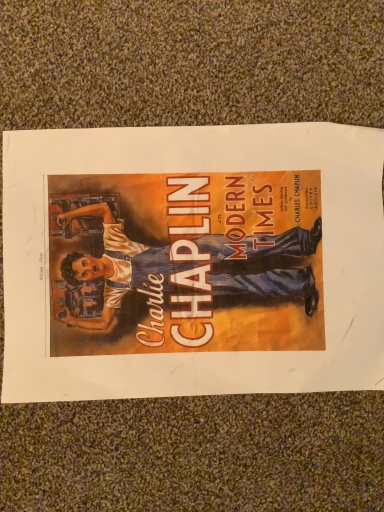
I want to click on matte paper poster at center, so click(192, 261).

Image resolution: width=384 pixels, height=512 pixels. What do you see at coordinates (192, 261) in the screenshot?
I see `matte paper poster at center` at bounding box center [192, 261].

Identify the location of matte paper poster at center. 192,261.